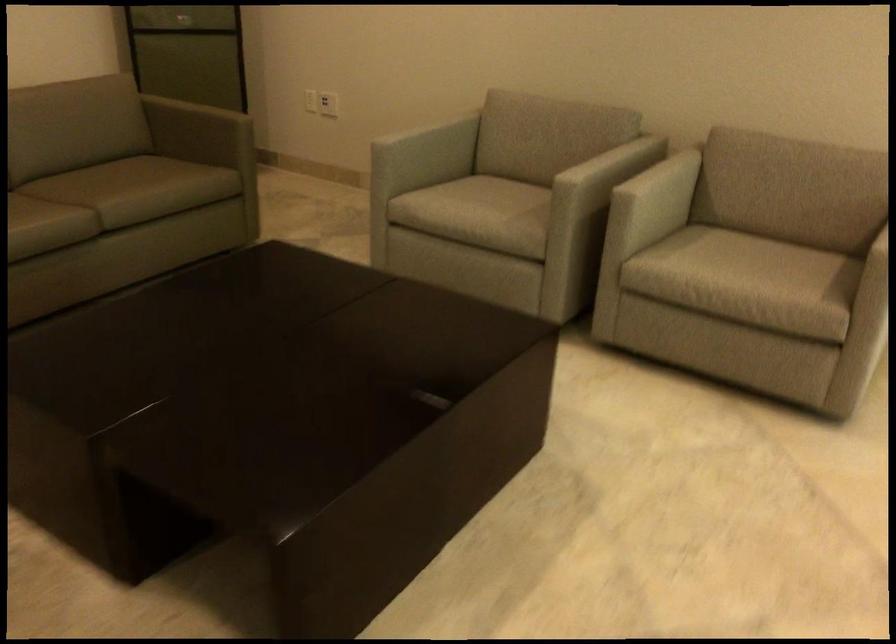
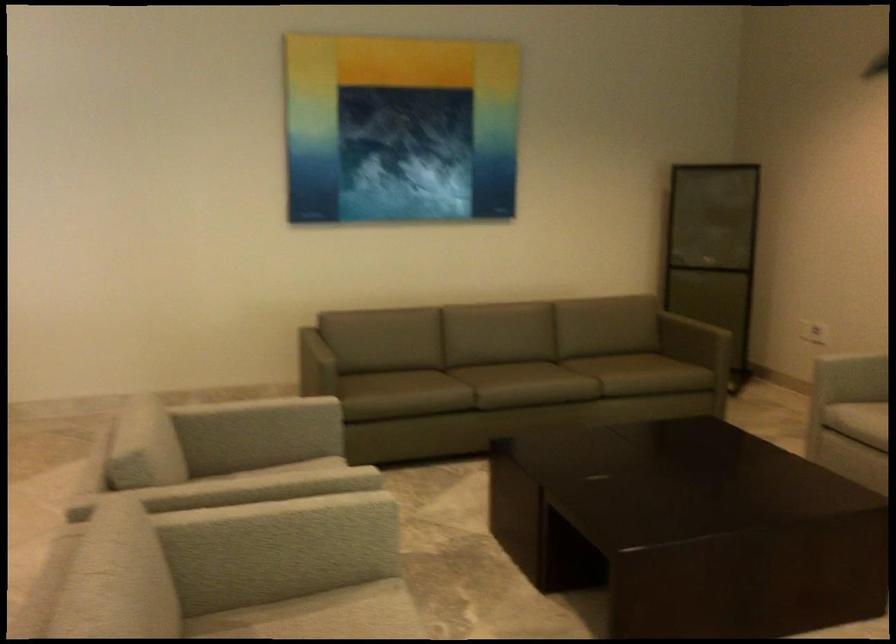
Find the pixel in the second image that matches pixel 442 205 in the first image.

(857, 420)